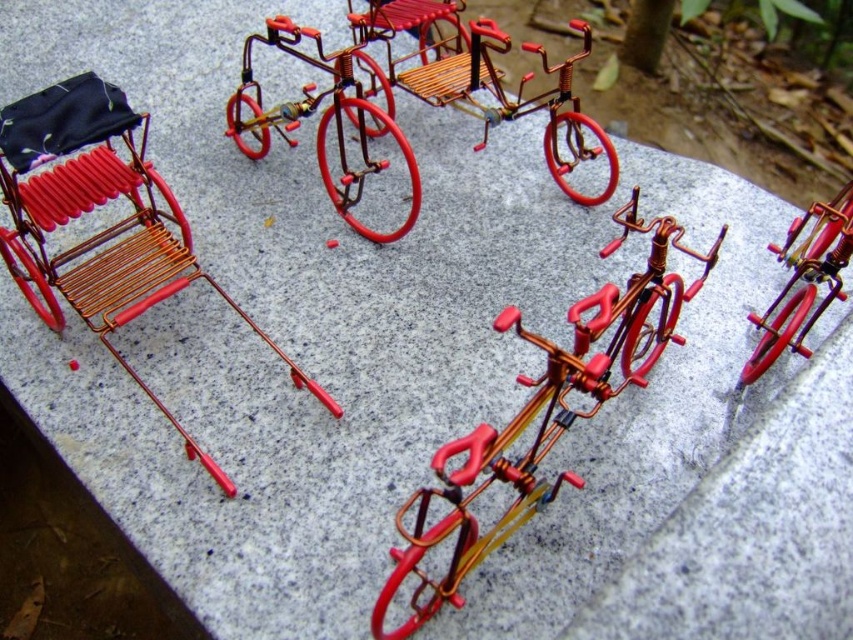
You are a visitor at an outdoor art exhibition and notice two miniature vehicles on display. You see the copper wire bicycle at center and the metallic wire tricycle at center. Which one is placed higher up?

The copper wire bicycle at center is positioned under the metallic wire tricycle at center, so the tricycle is higher up.

You are standing in front of the image and want to place a small decorative plant next to the metallic wire tricycle at center. Based on the coordinates provided, where should you position the plant relative to the tricycle?

The metallic wire tricycle at center is located at point (415, 96). To place the plant next to it, position it near those coordinates, ensuring it aligns with the tricycle on the stone surface.

You are a photographer trying to capture a detailed shot of the miniature bicycles on the stone surface. You notice two specific points marked as point 1 at coordinates (142, 381) and point 2 at (804, 348). Which point should you focus on first to ensure both points are in sharp focus?

You should focus on point 1 at coordinates (142, 381) first because it is closer to the camera than point 2 at (804, 348). By focusing on the closer point, the depth of field may help keep both points in focus.